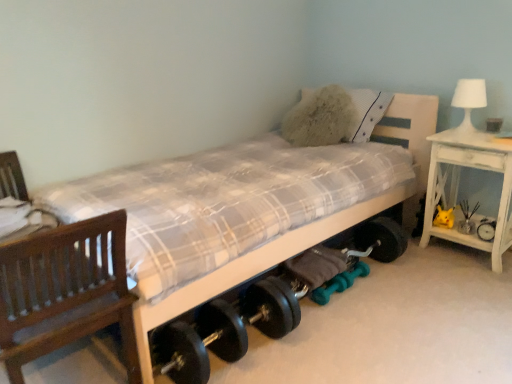
The width and height of the screenshot is (512, 384). Identify the location of free space between white distressed wood nightstand at right and teal rubber dumbbell at lower center, which appears as the 2th dumbbell when viewed from the left. (429, 273).